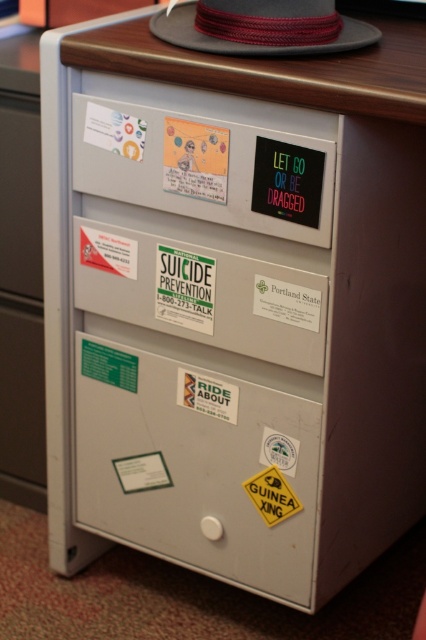
Looking at this image, please provide the coordinates of the gray felt fedora at upper center in the image.

The gray felt fedora at upper center is located at coordinates point (247, 36).

You are organizing a small item that is 10 cm in width. You have a white matte drawer at center and a gray felt fedora at upper center. Which container can fit the item based on their sizes?

The white matte drawer at center is larger in size than the gray felt fedora at upper center, so the item can fit in the white matte drawer at center.

You are organizing a drawer and need to place a small box that requires 12 inches of vertical space. Given the white matte drawer at center and the yellow paper sign at lower center, which one can accommodate the box based on their heights?

The white matte drawer at center is taller than the yellow paper sign at lower center, so the white matte drawer at center can accommodate the small box requiring 12 inches of vertical space.